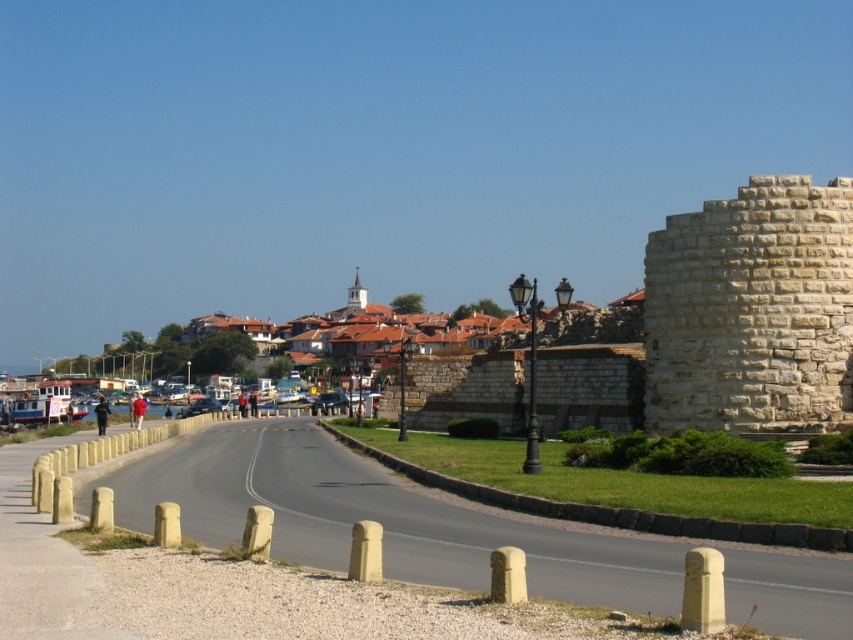
Question: Which point is farther from the camera taking this photo?

Choices:
 (A) (357, 308)
 (B) (721, 360)

Answer: (A)

Question: Is white stone tower at right below white stone tower at center?

Choices:
 (A) no
 (B) yes

Answer: (B)

Question: Which point appears closest to the camera in this image?

Choices:
 (A) (764, 244)
 (B) (357, 273)

Answer: (A)

Question: Can you confirm if white stone tower at right is positioned to the left of white stone tower at center?

Choices:
 (A) yes
 (B) no

Answer: (B)

Question: Does white stone tower at right appear on the right side of white stone tower at center?

Choices:
 (A) no
 (B) yes

Answer: (B)

Question: Which object appears farthest from the camera in this image?

Choices:
 (A) white stone tower at center
 (B) white stone tower at right

Answer: (A)